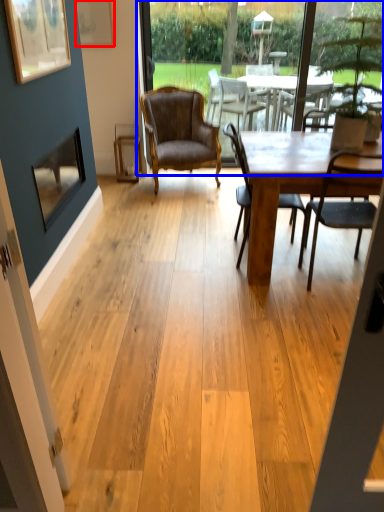
Question: Among these objects, which one is nearest to the camera, picture frame (highlighted by a red box) or window screen (highlighted by a blue box)?

Choices:
 (A) picture frame
 (B) window screen

Answer: (A)